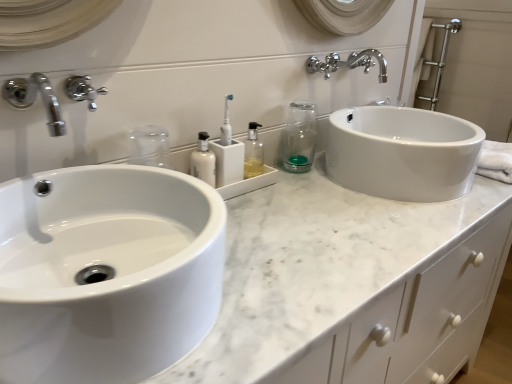
Identify the location of vacant area located to the right-hand side of white matte bottle at center, which is the 1th mouthwash from left to right. (278, 201).